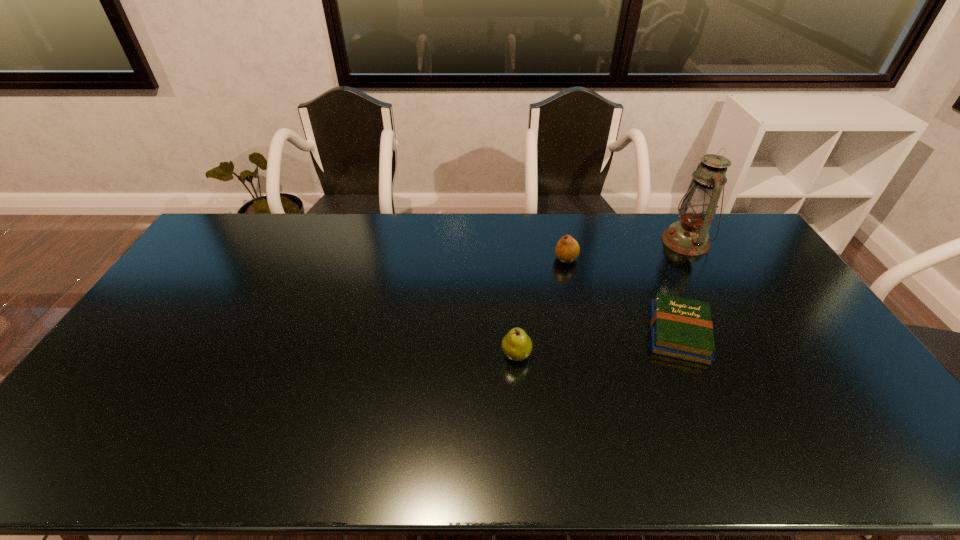
Where is `empty space between the book and the oil lamp`? This screenshot has width=960, height=540. empty space between the book and the oil lamp is located at coordinates (682, 287).

The height and width of the screenshot is (540, 960). What are the coordinates of `free space between the leftmost object and the oil lamp` in the screenshot? It's located at (601, 298).

At what (x,y) coordinates should I click in order to perform the action: click on vacant space that is in between the oil lamp and the farther pear. Please return your answer as a coordinate pair (x, y). The height and width of the screenshot is (540, 960). Looking at the image, I should click on (626, 250).

This screenshot has height=540, width=960. Identify the location of vacant region between the tallest object and the left pear. (601, 298).

Image resolution: width=960 pixels, height=540 pixels. What are the coordinates of `free space between the shortest object and the right pear` in the screenshot? It's located at (622, 296).

Identify which object is located as the nearest to the oil lamp. Please provide its 2D coordinates. Your answer should be formatted as a tuple, i.e. [(x, y)], where the tuple contains the x and y coordinates of a point satisfying the conditions above.

[(681, 328)]

Where is `object that is the second closest to the nearer pear`? The image size is (960, 540). object that is the second closest to the nearer pear is located at coordinates (567, 249).

Find the location of a particular element. The height and width of the screenshot is (540, 960). free location that satisfies the following two spatial constraints: 1. on the back side of the leftmost object; 2. on the left side of the oil lamp is located at coordinates (508, 241).

I want to click on free location that satisfies the following two spatial constraints: 1. on the back side of the leftmost object; 2. on the left side of the third object from right to left, so click(x=509, y=259).

The height and width of the screenshot is (540, 960). Find the location of `vacant space that satisfies the following two spatial constraints: 1. on the back side of the book; 2. on the left side of the left pear`. vacant space that satisfies the following two spatial constraints: 1. on the back side of the book; 2. on the left side of the left pear is located at coordinates (515, 333).